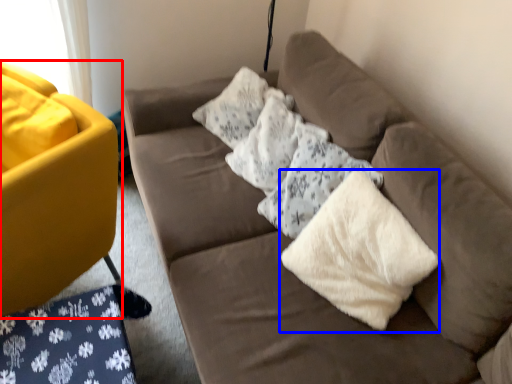
Question: Which of the following is the farthest to the observer, studio couch (highlighted by a red box) or material (highlighted by a blue box)?

Choices:
 (A) studio couch
 (B) material

Answer: (A)